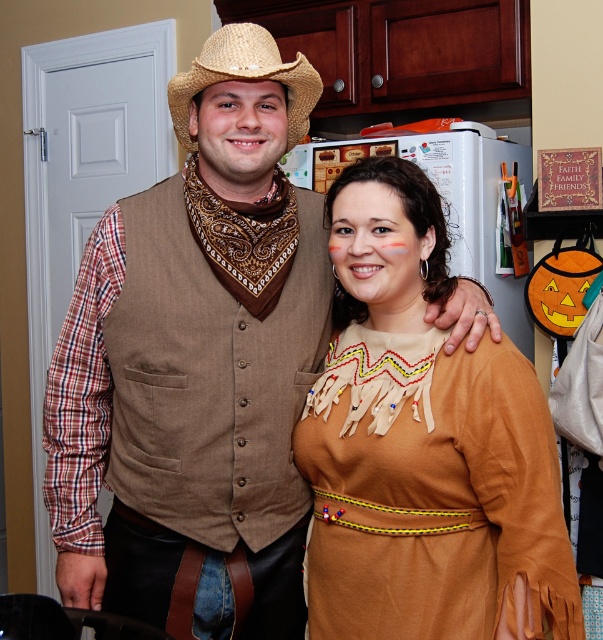
Question: Which of the following is the closest to the observer?

Choices:
 (A) brown leather dress at center
 (B) strawhat at center

Answer: (A)

Question: Which point is closer to the camera?

Choices:
 (A) brown leather dress at center
 (B) brown woven vest at center
 (C) strawhat at center

Answer: (A)

Question: From the image, what is the correct spatial relationship of brown leather dress at center in relation to strawhat at center?

Choices:
 (A) below
 (B) above

Answer: (A)

Question: Is brown woven vest at center closer to the viewer compared to brown leather dress at center?

Choices:
 (A) yes
 (B) no

Answer: (B)

Question: Which of the following is the closest to the observer?

Choices:
 (A) brown leather dress at center
 (B) brown woven vest at center

Answer: (A)

Question: Does brown leather dress at center have a lesser width compared to strawhat at center?

Choices:
 (A) yes
 (B) no

Answer: (B)